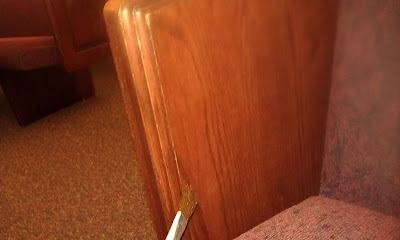
Where is `backrest of seat`? The height and width of the screenshot is (240, 400). backrest of seat is located at coordinates (22, 12).